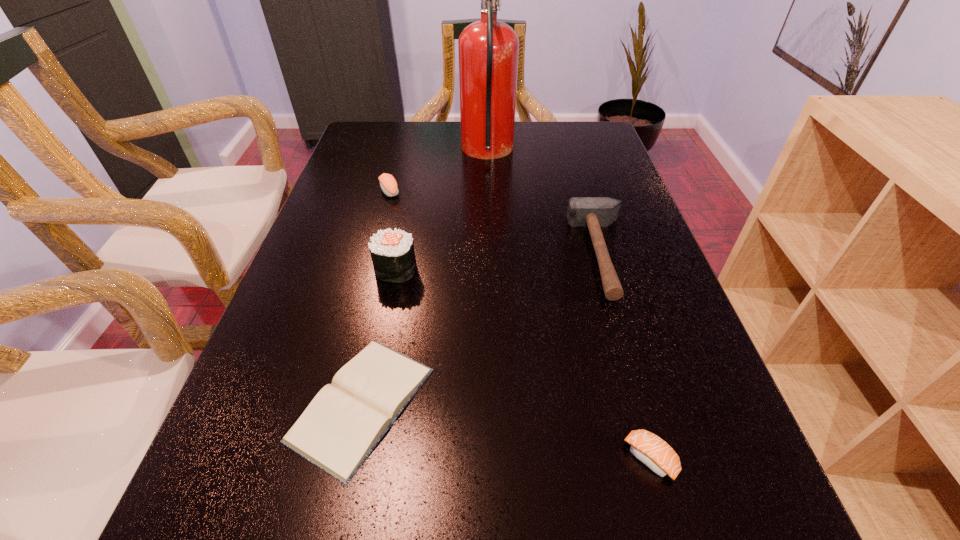
This screenshot has width=960, height=540. I want to click on object that is at the far edge, so click(488, 50).

You are a GUI agent. You are given a task and a screenshot of the screen. Output one action in this format:
    pyautogui.click(x=<x>, y=<y>)
    Task: Click on the sushi present at the left edge
    
    Given the screenshot: What is the action you would take?
    pyautogui.click(x=388, y=184)

Identify the location of Bible that is at the left edge. (345, 421).

Where is `hammer that is positioned at the right edge`? hammer that is positioned at the right edge is located at coordinates (593, 212).

You are a GUI agent. You are given a task and a screenshot of the screen. Output one action in this format:
    pyautogui.click(x=<x>, y=<y>)
    Task: Click on the sushi at the right edge
    The image size is (960, 540).
    Given the screenshot: What is the action you would take?
    651,450

Locate an element on the screen. vacant space at the far edge of the desktop is located at coordinates (519, 128).

Find the location of a particular element. The image size is (960, 540). free spot at the left edge of the desktop is located at coordinates (291, 301).

The height and width of the screenshot is (540, 960). Identify the location of vacant space at the right edge of the desktop. (645, 268).

Identify the location of vacant space at the far left corner. (389, 156).

This screenshot has height=540, width=960. In order to click on free space at the far right corner in this screenshot , I will do `click(569, 148)`.